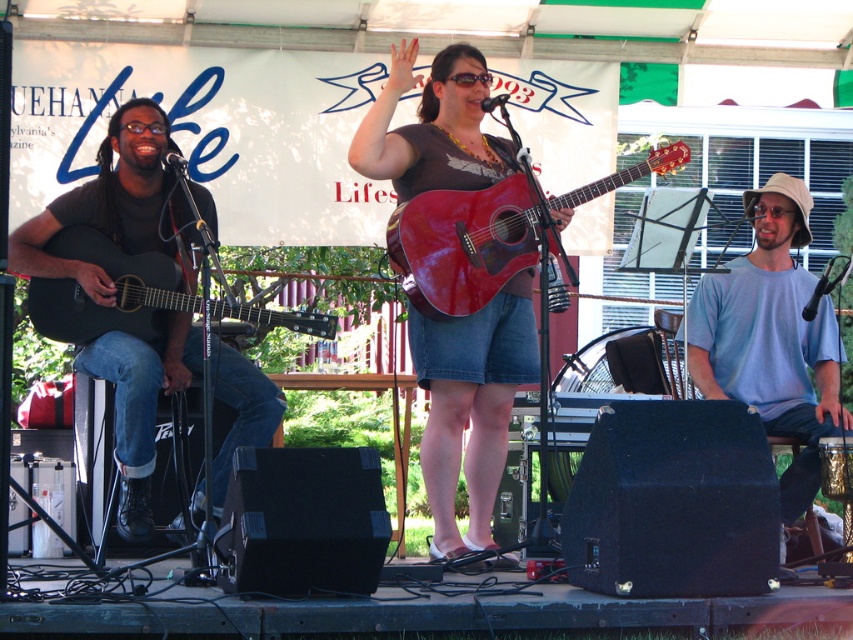
Question: Is shiny red guitar at center thinner than light blue cotton shirt at right?

Choices:
 (A) no
 (B) yes

Answer: (B)

Question: Which of the following is the farthest from the observer?

Choices:
 (A) (799, 403)
 (B) (155, 266)
 (C) (164, 113)

Answer: (A)

Question: Which point is farther to the camera?

Choices:
 (A) matte black acoustic guitar at left
 (B) shiny red guitar at center

Answer: (B)

Question: Is shiny red guitar at center below matte black acoustic guitar at left?

Choices:
 (A) no
 (B) yes

Answer: (B)

Question: Does shiny red guitar at center appear on the left side of glossy wood guitar at center?

Choices:
 (A) yes
 (B) no

Answer: (A)

Question: Which object is the closest to the shiny red guitar at center?

Choices:
 (A) matte black acoustic guitar at left
 (B) glossy wood guitar at center

Answer: (B)